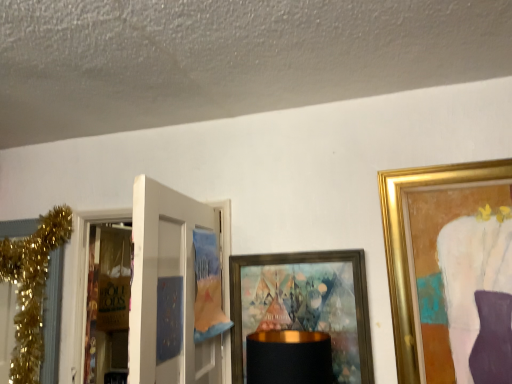
Question: Considering their positions, is gold-framed artwork at center located in front of or behind gold glitter garland at left?

Choices:
 (A) front
 (B) behind

Answer: (A)

Question: From the image's perspective, is gold-framed artwork at center positioned above or below gold glitter garland at left?

Choices:
 (A) below
 (B) above

Answer: (A)

Question: Which object is the farthest from the gold-framed artwork at center?

Choices:
 (A) brown paper bag at left
 (B) white matte door at left
 (C) gold glitter garland at left

Answer: (A)

Question: Which object is positioned closest to the gold-framed artwork at center?

Choices:
 (A) white matte door at left
 (B) gold glitter garland at left
 (C) brown paper bag at left

Answer: (A)